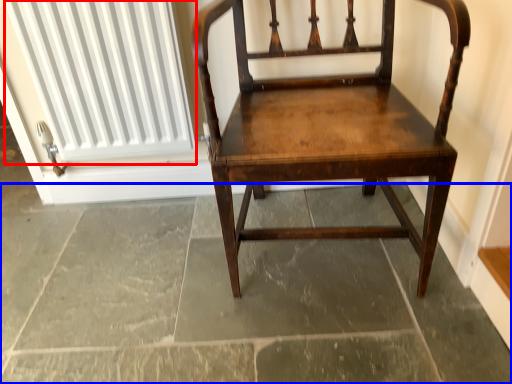
Question: Which point is closer to the camera, radiator (highlighted by a red box) or concrete (highlighted by a blue box)?

Choices:
 (A) radiator
 (B) concrete

Answer: (B)